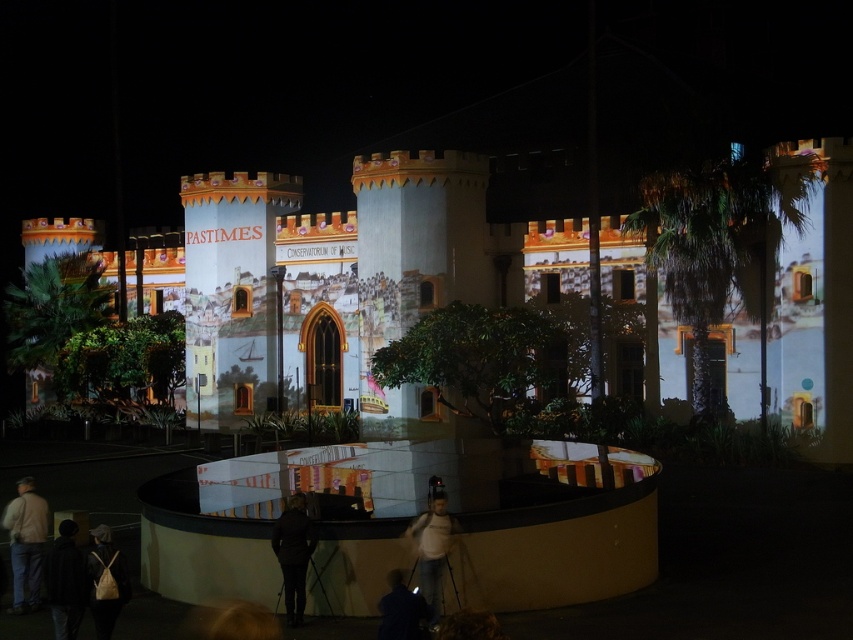
Is light beige jacket at lower left bigger than leather backpack at lower left?

Indeed, light beige jacket at lower left has a larger size compared to leather backpack at lower left.

At what (x,y) coordinates should I click in order to perform the action: click on light beige jacket at lower left. Please return your answer as a coordinate pair (x, y). Looking at the image, I should click on (25, 541).

Where is `light beige jacket at lower left`? light beige jacket at lower left is located at coordinates (25, 541).

What do you see at coordinates (347, 285) in the screenshot? I see `matte white castle at center` at bounding box center [347, 285].

Is matte white castle at center behind dark brown leather jacket at center?

Yes.

Does point (554, 291) come closer to viewer compared to point (305, 506)?

No.

You are a GUI agent. You are given a task and a screenshot of the screen. Output one action in this format:
    pyautogui.click(x=<x>, y=<y>)
    Task: Click on the matte white castle at center
    
    Given the screenshot: What is the action you would take?
    pyautogui.click(x=347, y=285)

Does point (33, 566) lie in front of point (289, 618)?

No.

Who is more distant from viewer, (22,531) or (303,499)?

Positioned behind is point (22,531).

This screenshot has width=853, height=640. I want to click on light beige jacket at lower left, so click(25, 541).